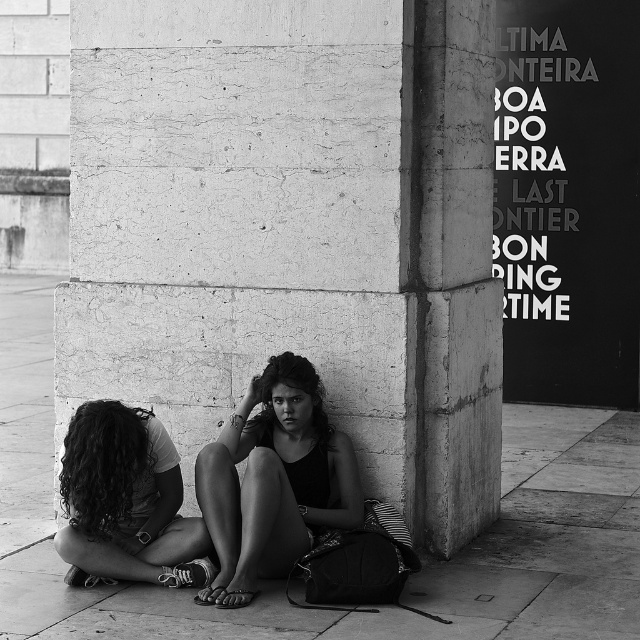
You are standing 30 feet away from the camera. You want to touch the smooth concrete pillar at center. Can you reach it without moving?

The smooth concrete pillar at center is 28.43 feet away from the camera. Since you are 30 feet away from the camera, you are 1.57 feet away from the pillar and can reach it without moving.